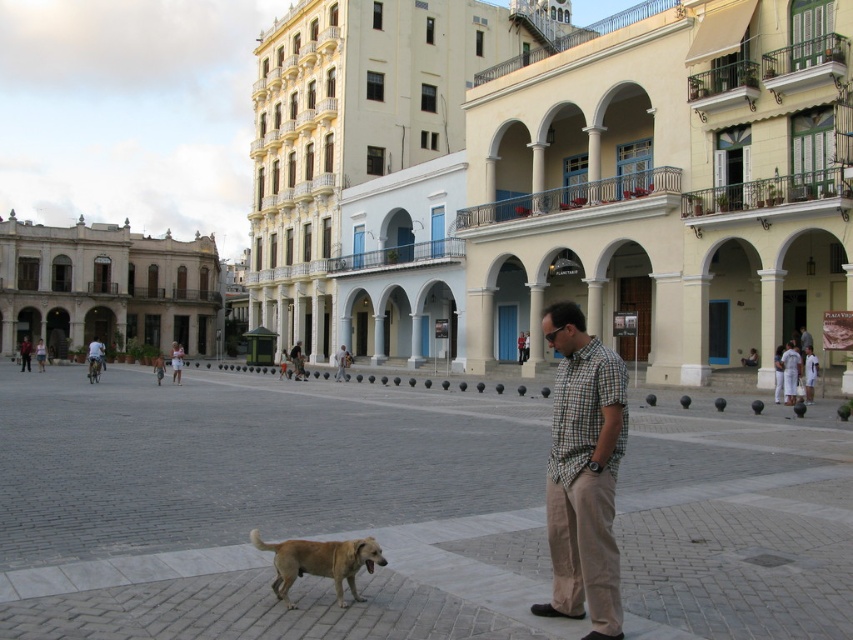
You are standing in the plaza and notice two points marked in the scene. Which point is closer to you, point (x=125, y=429) or point (x=384, y=557)?

Point (x=125, y=429) is closer to you because it is further to the viewer than point (x=384, y=557).

You are standing in the plaza and want to pet the golden fur dog at lower center. However, there is a checkered fabric shirt at center in your way. Can you reach the dog without moving the shirt?

The golden fur dog at lower center is closer to the viewer than the checkered fabric shirt at center, so you can reach the dog without needing to move the shirt as it is nearer to you.

You are a photographer trying to capture the golden fur dog at lower center and the checkered fabric shirt at center in the same frame. Based on their sizes, which object would appear smaller in the photo?

The golden fur dog at lower center has a lesser width compared to the checkered fabric shirt at center, so it would appear smaller in the photo.